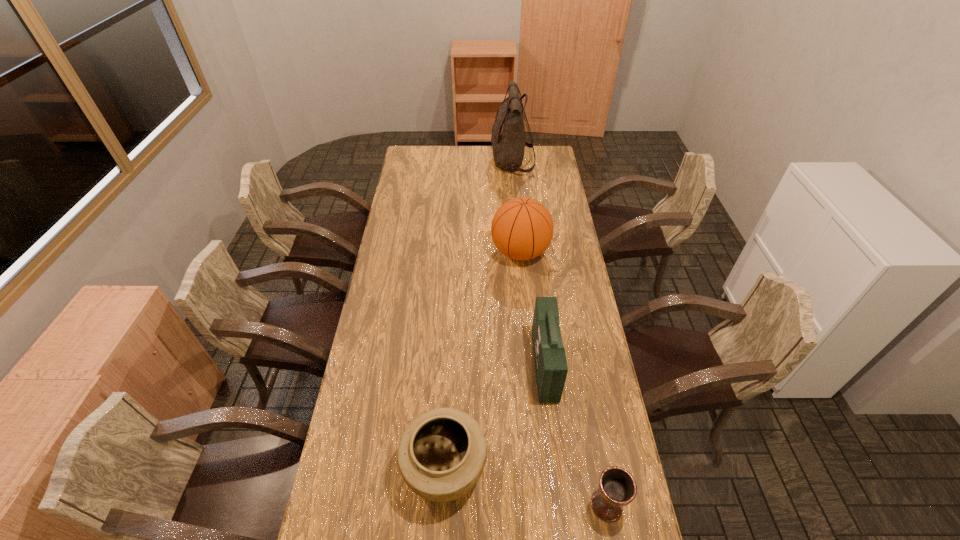
Locate an element on the screen. The height and width of the screenshot is (540, 960). vacant space in between the backpack and the third tallest object is located at coordinates (528, 264).

The height and width of the screenshot is (540, 960). In order to click on free area in between the pottery and the first-aid kit in this screenshot , I will do `click(494, 417)`.

Point out which object is positioned as the fourth nearest to the backpack. Please provide its 2D coordinates. Your answer should be formatted as a tuple, i.e. [(x, y)], where the tuple contains the x and y coordinates of a point satisfying the conditions above.

[(617, 488)]

What are the coordinates of `object identified as the fourth closest to the backpack` in the screenshot? It's located at (617, 488).

Locate an element on the screen. This screenshot has height=540, width=960. free space in the image that satisfies the following two spatial constraints: 1. on the front-facing side of the chalice; 2. on the right side of the third shortest object is located at coordinates (562, 505).

Where is `blank space that satisfies the following two spatial constraints: 1. on the back side of the chalice; 2. on the open flap of the farthest object`? This screenshot has height=540, width=960. blank space that satisfies the following two spatial constraints: 1. on the back side of the chalice; 2. on the open flap of the farthest object is located at coordinates (543, 162).

At what (x,y) coordinates should I click in order to perform the action: click on blank area in the image that satisfies the following two spatial constraints: 1. on the open flap of the backpack; 2. on the back side of the chalice. Please return your answer as a coordinate pair (x, y). Looking at the image, I should click on (544, 505).

The image size is (960, 540). Identify the location of vacant space that satisfies the following two spatial constraints: 1. on the open flap of the farthest object; 2. on the front side of the basketball. (520, 252).

The width and height of the screenshot is (960, 540). I want to click on free space that satisfies the following two spatial constraints: 1. on the back side of the chalice; 2. on the open flap of the farthest object, so click(x=543, y=162).